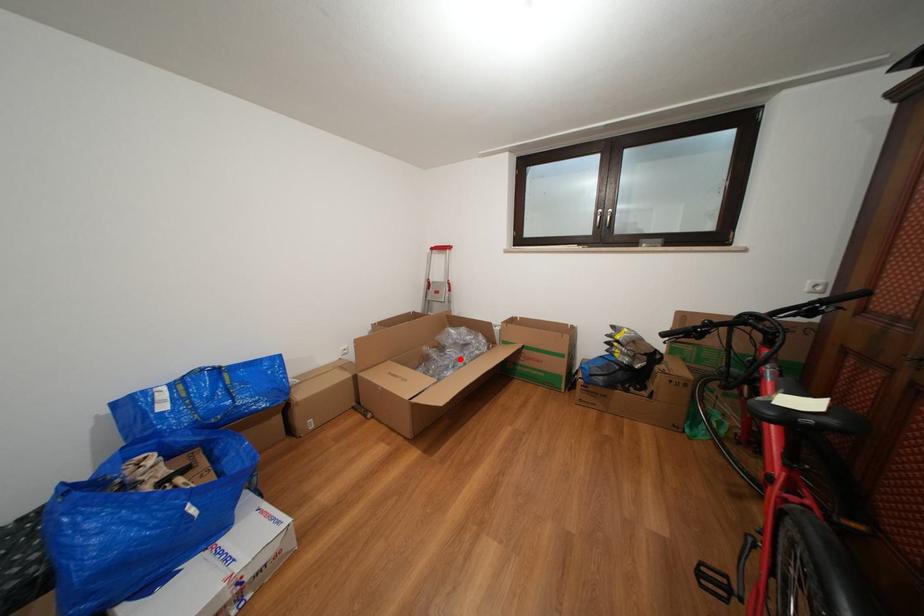
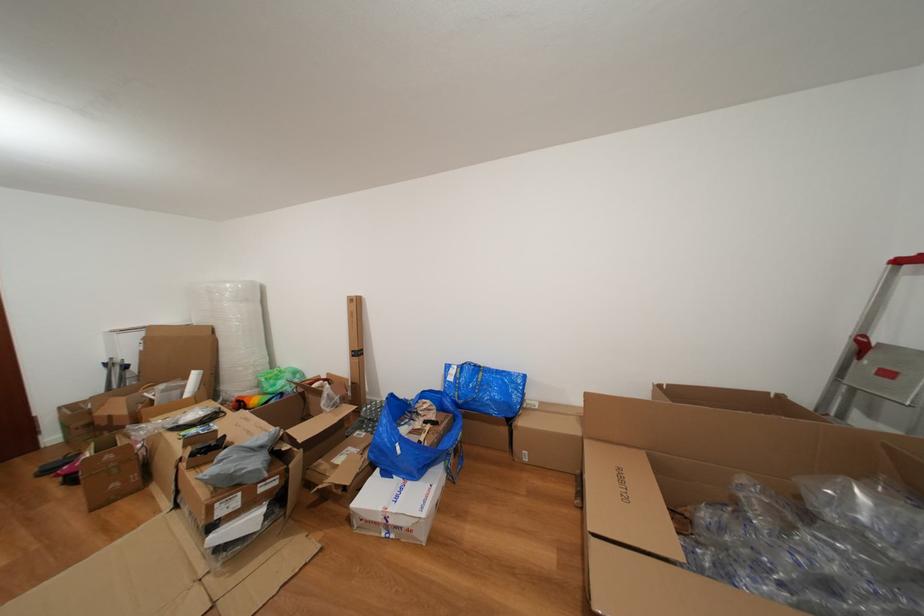
The point at the highlighted location is marked in the first image. Where is the corresponding point in the second image?

(839, 559)